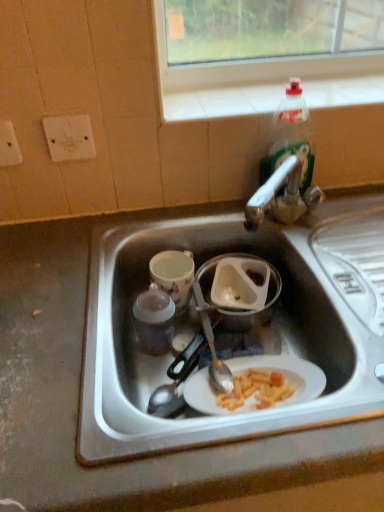
Question: In the image, is clear plastic bottle at upper right positioned in front of or behind porcelain cup at center-left?

Choices:
 (A) behind
 (B) front

Answer: (B)

Question: Is clear plastic bottle at upper right taller or shorter than porcelain cup at center-left?

Choices:
 (A) short
 (B) tall

Answer: (B)

Question: Estimate the real-world distances between objects in this image. Which object is farther from the white matte sink at center?

Choices:
 (A) clear plastic bottle at upper right
 (B) porcelain cup at center-left
 (C) white plastic container at center

Answer: (A)

Question: Based on their relative distances, which object is farther from the white plastic container at center?

Choices:
 (A) clear plastic bottle at upper right
 (B) white matte sink at center
 (C) porcelain cup at center-left

Answer: (A)